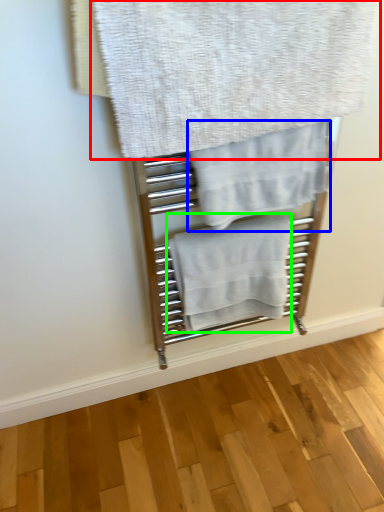
Question: Which is nearer to the towel (highlighted by a red box)? towel (highlighted by a blue box) or towel (highlighted by a green box).

Choices:
 (A) towel
 (B) towel

Answer: (A)